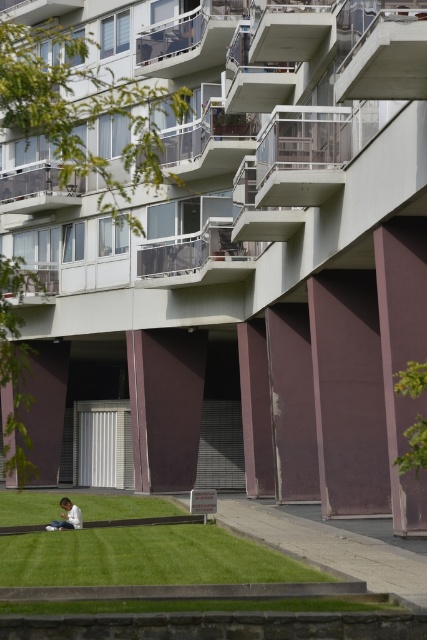
You are a delivery person trying to place a package on the glassy white balcony at upper left. The package is as wide as the white cotton shirt at lower center. Will the package fit on the balcony?

The glassy white balcony at upper left might be wider than the white cotton shirt at lower center, so the package should fit since the balcony is likely wider.

You are a visitor approaching the building and see the green grass at lower center and the clear glass balcony at center. Which of these two features is located lower in the image?

The green grass at lower center is located below the clear glass balcony at center, so it is the lower feature in the image.